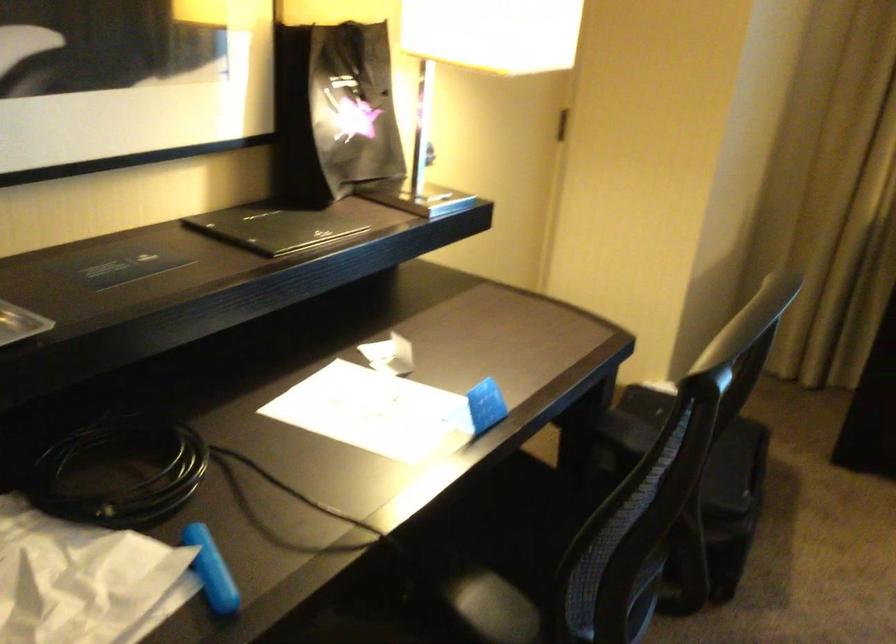
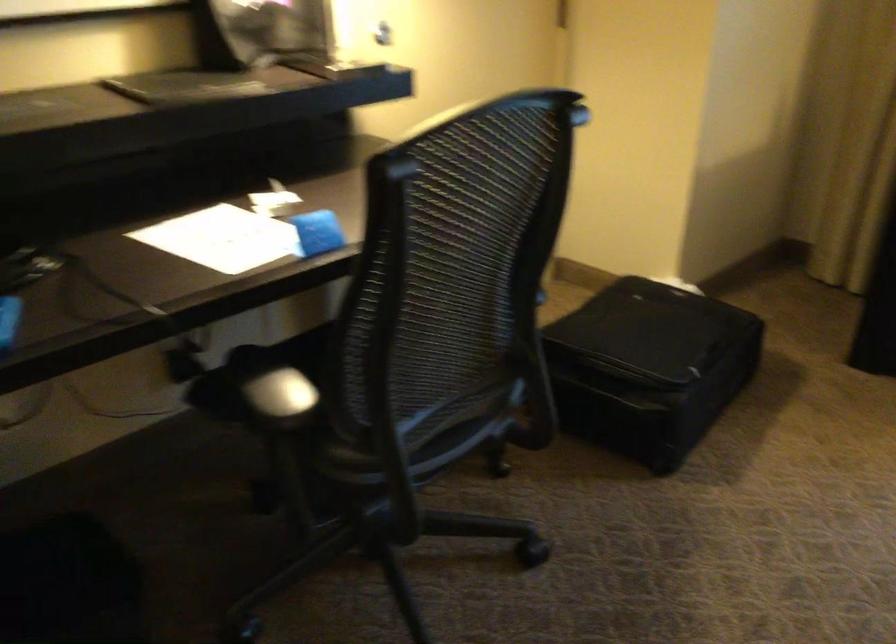
In the second image, find the point that corresponds to point (711, 494) in the first image.

(649, 366)